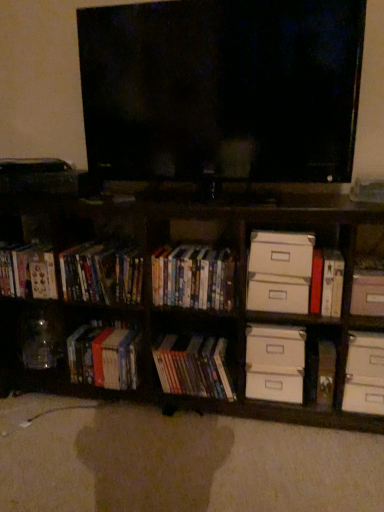
The height and width of the screenshot is (512, 384). What do you see at coordinates (193, 309) in the screenshot?
I see `wooden bookcase at lower left` at bounding box center [193, 309].

Measure the distance between point (274, 377) and camera.

1.58 meters.

Locate an element on the screen. white cardboard drawer at center, which is the 3th drawer in bottom-to-top order is located at coordinates (277, 297).

What do you see at coordinates (281, 253) in the screenshot?
I see `white cardboard drawer at upper right, which is the fourth drawer from bottom to top` at bounding box center [281, 253].

This screenshot has height=512, width=384. In order to click on hardcover book at lower right, placed as the second paperback book when sorted from top to bottom in this screenshot , I will do `click(326, 373)`.

This screenshot has height=512, width=384. I want to click on hardcover book at right, which ranks as the first paperback book in top-to-bottom order, so click(332, 283).

The width and height of the screenshot is (384, 512). What are the coordinates of `wooden bookcase at lower left` in the screenshot? It's located at (193, 309).

Is hardcover books at center, which appears as the 4th book when viewed from the left, located outside white cardboard drawer at center, the 2th drawer in the top-to-bottom sequence?

Absolutely, hardcover books at center, which appears as the 4th book when viewed from the left, is external to white cardboard drawer at center, the 2th drawer in the top-to-bottom sequence.

Considering the positions of point (188, 287) and point (264, 308), is point (188, 287) closer or farther from the camera than point (264, 308)?

Point (188, 287) is farther from the camera than point (264, 308).

Find the location of a particular element. The width and height of the screenshot is (384, 512). book that is the 1st one when counting backward from the white cardboard drawer at center, which is the 3th drawer in bottom-to-top order is located at coordinates (193, 277).

Between hardcover books at center, arranged as the first book when viewed from the right, and white cardboard drawer at center, which is the 3th drawer in bottom-to-top order, which one appears on the right side from the viewer's perspective?

From the viewer's perspective, white cardboard drawer at center, which is the 3th drawer in bottom-to-top order, appears more on the right side.

Considering the relative sizes of hardcover books at center, arranged as the first book when viewed from the right, and matte plastic dvds at left, which ranks as the second cabinet in right-to-left order, in the image provided, is hardcover books at center, arranged as the first book when viewed from the right, bigger than matte plastic dvds at left, which ranks as the second cabinet in right-to-left order,?

Incorrect, hardcover books at center, arranged as the first book when viewed from the right, is not larger than matte plastic dvds at left, which ranks as the second cabinet in right-to-left order.

From the picture: Are hardcover books at center, which appears as the 4th book when viewed from the left, and matte plastic dvds at left, which ranks as the second cabinet in right-to-left order, making contact?

No, hardcover books at center, which appears as the 4th book when viewed from the left, is not with matte plastic dvds at left, which ranks as the second cabinet in right-to-left order.

Does hardcover books at center, arranged as the first book when viewed from the right, come in front of matte plastic dvds at left, which ranks as the second cabinet in right-to-left order?

Yes, it is in front of matte plastic dvds at left, which ranks as the second cabinet in right-to-left order.

From the image's perspective, which is above, hardcover books at center, arranged as the first book when viewed from the right, or matte plastic dvds at left, the first cabinet viewed from the left?

matte plastic dvds at left, the first cabinet viewed from the left, from the image's perspective.

Is wooden bookcase at lower left oriented away from white cardboard box at right, which is the second cabinet from left to right?

Yes.

Can you confirm if wooden bookcase at lower left is shorter than white cardboard box at right, which is the second cabinet from left to right?

No, wooden bookcase at lower left is not shorter than white cardboard box at right, which is the second cabinet from left to right.

What's the angular difference between wooden bookcase at lower left and white cardboard box at right, which is the second cabinet from left to right,'s facing directions?

0.844 degrees separate the facing orientations of wooden bookcase at lower left and white cardboard box at right, which is the second cabinet from left to right.

From the picture: Between wooden bookcase at lower left and white cardboard box at right, the 1th cabinet positioned from the right, which one has smaller size?

With smaller size is white cardboard box at right, the 1th cabinet positioned from the right.

Identify the location of the 4th book below the white cardboard drawer at upper right, which is the fourth drawer from bottom to top (from the image's perspective). (193, 366).

In terms of height, does matte plastic books at center, positioned as the third book in left-to-right order, look taller or shorter compared to white cardboard drawer at upper right, which is the first drawer from top to bottom?

In the image, matte plastic books at center, positioned as the third book in left-to-right order, appears to be taller than white cardboard drawer at upper right, which is the first drawer from top to bottom.

From the image's perspective, is matte plastic books at center, positioned as the third book in left-to-right order, located above white cardboard drawer at upper right, which is the fourth drawer from bottom to top?

No, from the image's perspective, matte plastic books at center, positioned as the third book in left-to-right order, is not on top of white cardboard drawer at upper right, which is the fourth drawer from bottom to top.

Considering their positions, is matte plastic books at center, the 2th book in the right-to-left sequence, located in front of or behind white cardboard drawer at upper right, which is the fourth drawer from bottom to top?

matte plastic books at center, the 2th book in the right-to-left sequence, is behind white cardboard drawer at upper right, which is the fourth drawer from bottom to top.

Is point (325, 373) farther from viewer compared to point (104, 343)?

That is False.

Is hardcover book at lower right, which ranks as the first paperback book in bottom-to-top order, oriented away from hardcover books at left, the third book viewed from the right?

No.

In terms of height, does hardcover book at lower right, which ranks as the first paperback book in bottom-to-top order, look taller or shorter compared to hardcover books at left, the third book viewed from the right?

In the image, hardcover book at lower right, which ranks as the first paperback book in bottom-to-top order, appears to be shorter than hardcover books at left, the third book viewed from the right.

The width and height of the screenshot is (384, 512). Identify the location of paperback book that is the 2nd object to the right of the hardcover books at left, the third book viewed from the right, starting at the anchor. (326, 373).

Starting from the hardcover book at lower right, which ranks as the first paperback book in bottom-to-top order, which book is the 3rd one behind? Please provide its 2D coordinates.

[(104, 357)]

Considering the relative positions of hardcover books at left, the third book viewed from the right, and hardcover book at lower right, which ranks as the first paperback book in bottom-to-top order, in the image provided, is hardcover books at left, the third book viewed from the right, to the right of hardcover book at lower right, which ranks as the first paperback book in bottom-to-top order, from the viewer's perspective?

Incorrect, hardcover books at left, the third book viewed from the right, is not on the right side of hardcover book at lower right, which ranks as the first paperback book in bottom-to-top order.

In terms of height, does hardcover books at left, the 2th book from the left, look taller or shorter compared to hardcover book at lower right, placed as the second paperback book when sorted from top to bottom?

In the image, hardcover books at left, the 2th book from the left, appears to be taller than hardcover book at lower right, placed as the second paperback book when sorted from top to bottom.

Which object is positioned more to the right, matte plastic dvds at left, which ranks as the second cabinet in right-to-left order, or hardcover books at center, which appears as the 4th book when viewed from the left?

Positioned to the right is hardcover books at center, which appears as the 4th book when viewed from the left.

Can you confirm if matte plastic dvds at left, which ranks as the second cabinet in right-to-left order, is bigger than hardcover books at center, which appears as the 4th book when viewed from the left?

Yes.

Which is in front, point (68, 282) or point (179, 246)?

The point (68, 282) is closer to the camera.

Looking at this image, is matte plastic dvds at left, the first cabinet viewed from the left, behind hardcover books at center, which appears as the 4th book when viewed from the left?

Yes, matte plastic dvds at left, the first cabinet viewed from the left, is behind hardcover books at center, which appears as the 4th book when viewed from the left.

Where is `the 1st drawer directly beneath the hardcover books at center, which appears as the 4th book when viewed from the left (from a real-world perspective)`? the 1st drawer directly beneath the hardcover books at center, which appears as the 4th book when viewed from the left (from a real-world perspective) is located at coordinates (277, 297).

What are the coordinates of `cabinet to the left of hardcover books at center, which appears as the 4th book when viewed from the left` in the screenshot? It's located at (102, 273).

Estimate the real-world distances between objects in this image. Which object is further from matte plastic dvds at left, the first cabinet viewed from the left, hardcover books at left, the third book viewed from the right, or hardcover book at right, the second paperback book ordered from the bottom?

hardcover book at right, the second paperback book ordered from the bottom, lies further to matte plastic dvds at left, the first cabinet viewed from the left, than the other object.

From the image, which object appears to be nearer to white cardboard drawer at upper right, which is the fourth drawer from bottom to top, matte plastic books at center, the 2th book in the right-to-left sequence, or hardcover book at lower right, placed as the second paperback book when sorted from top to bottom?

hardcover book at lower right, placed as the second paperback book when sorted from top to bottom, is closer to white cardboard drawer at upper right, which is the fourth drawer from bottom to top.

Estimate the real-world distances between objects in this image. Which object is closer to white cardboard drawer at lower right, arranged as the first drawer when ordered from the bottom, white cardboard drawer at center, the 2th drawer from the bottom, or wooden bookcase at lower left?

white cardboard drawer at center, the 2th drawer from the bottom.

Based on their spatial positions, is wooden bookcase at lower left or matte plastic books at center, the 2th book in the right-to-left sequence, closer to white cardboard drawer at center, the 2th drawer in the top-to-bottom sequence?

Based on the image, matte plastic books at center, the 2th book in the right-to-left sequence, appears to be nearer to white cardboard drawer at center, the 2th drawer in the top-to-bottom sequence.

Which object lies further to the anchor point hardcover book at left, which ranks as the 4th book in right-to-left order, white cardboard drawer at lower right, arranged as the first drawer when ordered from the bottom, or hardcover book at lower right, which ranks as the first paperback book in bottom-to-top order?

Based on the image, hardcover book at lower right, which ranks as the first paperback book in bottom-to-top order, appears to be further to hardcover book at left, which ranks as the 4th book in right-to-left order.

Estimate the real-world distances between objects in this image. Which object is further from hardcover book at lower right, which ranks as the first paperback book in bottom-to-top order, hardcover book at left, acting as the 1th book starting from the left, or white cardboard drawer at lower right, arranged as the fourth drawer when viewed from the top?

The object further to hardcover book at lower right, which ranks as the first paperback book in bottom-to-top order, is hardcover book at left, acting as the 1th book starting from the left.

When comparing their distances from white cardboard drawer at upper right, which is the fourth drawer from bottom to top, does matte plastic books at center, the 2th book in the right-to-left sequence, or white cardboard drawer at lower right, arranged as the fourth drawer when viewed from the top, seem further?

matte plastic books at center, the 2th book in the right-to-left sequence.

From the image, which object appears to be farther from white cardboard drawer at center, which is the 3th drawer in bottom-to-top order, white cardboard drawer at lower right, arranged as the first drawer when ordered from the bottom, or black glossy flat-screen tv at center?

black glossy flat-screen tv at center is positioned further to the anchor white cardboard drawer at center, which is the 3th drawer in bottom-to-top order.

Where is `cabinet between hardcover book at left, which ranks as the 4th book in right-to-left order, and white cardboard drawer at center, the 2th drawer in the top-to-bottom sequence, from left to right`? The width and height of the screenshot is (384, 512). cabinet between hardcover book at left, which ranks as the 4th book in right-to-left order, and white cardboard drawer at center, the 2th drawer in the top-to-bottom sequence, from left to right is located at coordinates (102, 273).

Locate an element on the screen. This screenshot has width=384, height=512. bookcase between hardcover book at left, acting as the 1th book starting from the left, and white cardboard drawer at center, the 2th drawer in the top-to-bottom sequence, from left to right is located at coordinates (193, 309).

This screenshot has height=512, width=384. Identify the location of television located between hardcover book at left, which ranks as the 4th book in right-to-left order, and white cardboard drawer at center, the 3th drawer when ordered from top to bottom, in the left-right direction. (222, 89).

This screenshot has height=512, width=384. In order to click on drawer between matte plastic books at center, the 2th book in the right-to-left sequence, and white cardboard drawer at center, which is the 3th drawer in bottom-to-top order, in the horizontal direction in this screenshot , I will do tap(275, 347).